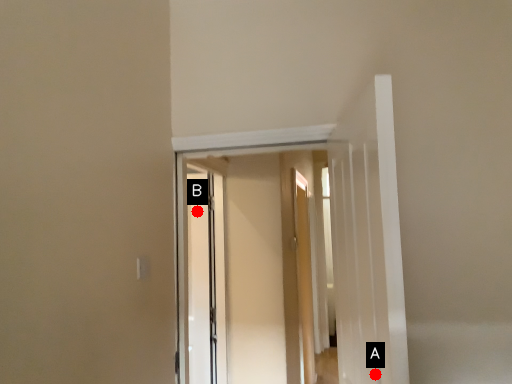
Question: Two points are circled on the image, labeled by A and B beside each circle. Which point is closer to the camera?

Choices:
 (A) A is closer
 (B) B is closer

Answer: (A)